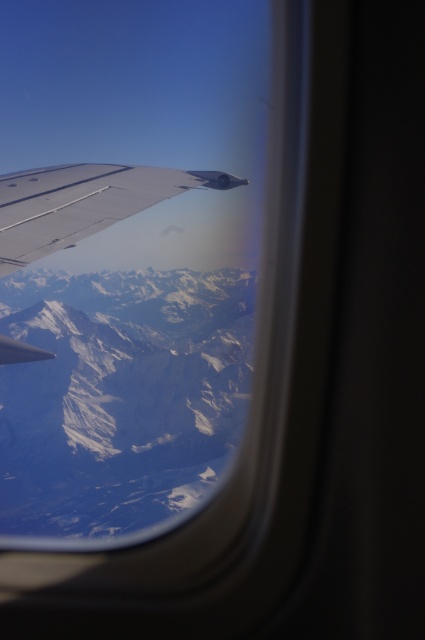
You are a passenger sitting in an airplane seat and looking out the window. You notice a point marked at coordinates (121, 396) on your window. Based on the scene, where is this point located?

The point at (121, 396) is located on the white snow covered mountain range at center.